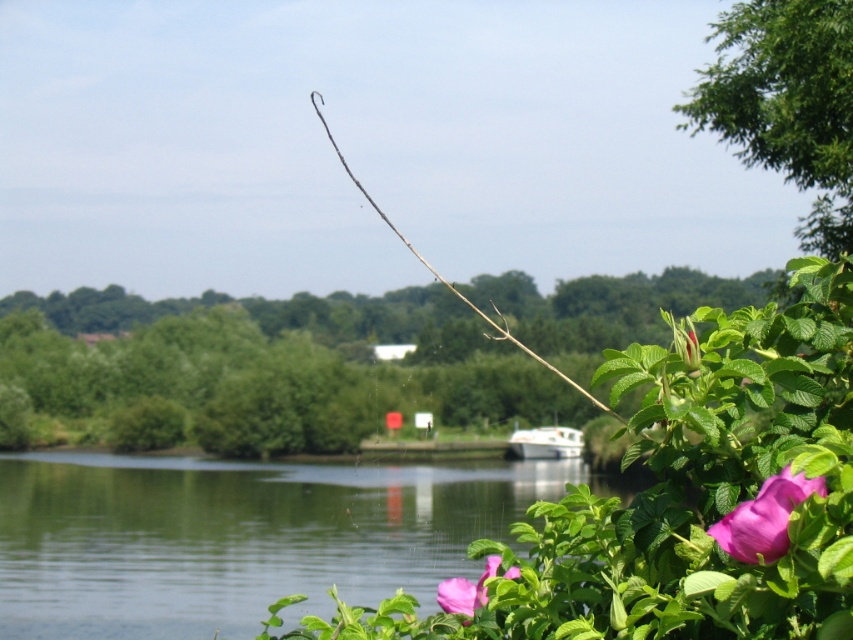
You are a photographer standing at the riverside. You want to take a photo that includes both the pink matte flower at lower right and the white glossy boat at center. Given that your camera has a maximum zoom range of 20 meters, will you be able to capture both subjects in a single frame without moving your position?

The distance between the pink matte flower at lower right and the white glossy boat at center is 32.02 meters. Since the camera can only zoom up to 20 meters, you won not be able to capture both subjects in a single frame without moving.

You are standing at the riverside and want to place a small flag at each of the two points marked in the image. The first point is at coordinate point(753, 500) and the second is at point(570, 436). Which point is closer to you where you should place the flag first?

The point at coordinate point(753, 500) is closer to you, so you should place the flag there first.